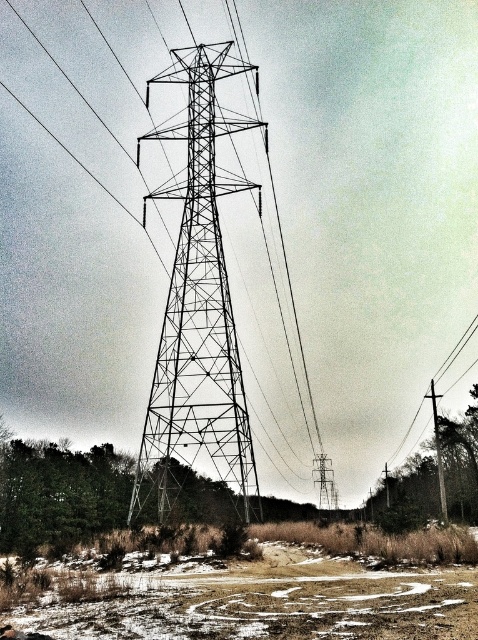
You are standing in front of the electrical transmission tower and want to determine which of the two points, point (456, 561) or point (212, 65), is nearer to you. Based on the scene, which point is closer?

Point (456, 561) is closer to the camera than point (212, 65), so it is the nearer one.

Looking at this image, you are standing at the origin point of the coordinate system. You want to walk towards the metallic wireframe tower at center. Which direction should you move in to reach it?

The metallic wireframe tower at center is located at point (x=197, y=305), so you should move in the direction of increasing x and y coordinates to reach it.